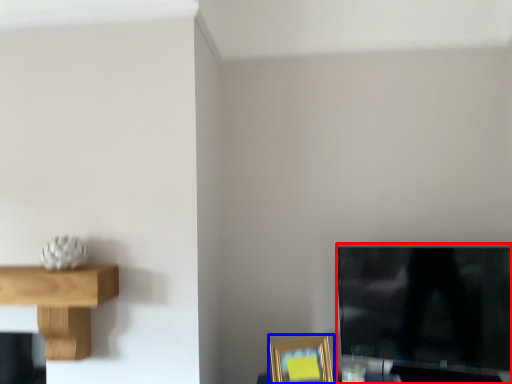
Question: Which object is further to the camera taking this photo, television (highlighted by a red box) or picture frame (highlighted by a blue box)?

Choices:
 (A) television
 (B) picture frame

Answer: (B)